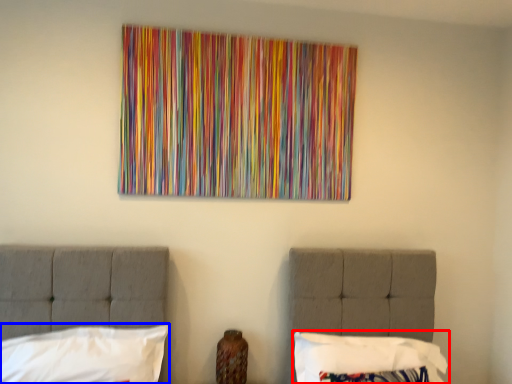
Question: Which object is closer to the camera taking this photo, pillow (highlighted by a red box) or pillow (highlighted by a blue box)?

Choices:
 (A) pillow
 (B) pillow

Answer: (B)